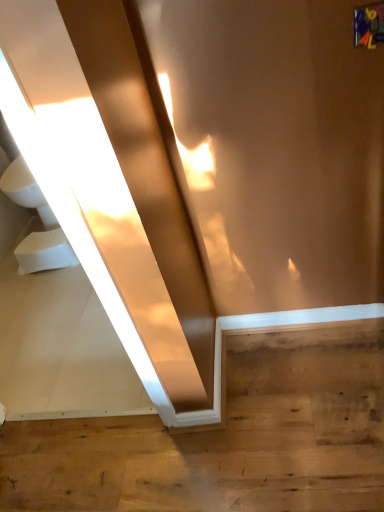
Question: Is wooden floor at lower right in contact with white glossy sink at left?

Choices:
 (A) no
 (B) yes

Answer: (A)

Question: Does wooden floor at lower right appear on the left side of white glossy sink at left?

Choices:
 (A) no
 (B) yes

Answer: (A)

Question: From the image's perspective, does wooden floor at lower right appear lower than white glossy sink at left?

Choices:
 (A) no
 (B) yes

Answer: (B)

Question: Could you tell me if wooden floor at lower right is facing white glossy sink at left?

Choices:
 (A) no
 (B) yes

Answer: (A)

Question: Does wooden floor at lower right have a larger size compared to white glossy sink at left?

Choices:
 (A) no
 (B) yes

Answer: (A)

Question: Considering the relative positions of wooden floor at lower right and white glossy sink at left in the image provided, is wooden floor at lower right to the right of white glossy sink at left from the viewer's perspective?

Choices:
 (A) yes
 (B) no

Answer: (A)

Question: From the image's perspective, is wooden floor at lower right below white foam toilet bowl at lower left?

Choices:
 (A) no
 (B) yes

Answer: (B)

Question: From the image's perspective, is wooden floor at lower right on white foam toilet bowl at lower left?

Choices:
 (A) no
 (B) yes

Answer: (A)

Question: Does wooden floor at lower right have a lesser height compared to white foam toilet bowl at lower left?

Choices:
 (A) yes
 (B) no

Answer: (A)

Question: Is wooden floor at lower right positioned beyond the bounds of white foam toilet bowl at lower left?

Choices:
 (A) no
 (B) yes

Answer: (B)

Question: Is wooden floor at lower right positioned far away from white foam toilet bowl at lower left?

Choices:
 (A) yes
 (B) no

Answer: (A)

Question: Can you confirm if wooden floor at lower right is positioned to the left of white foam toilet bowl at lower left?

Choices:
 (A) no
 (B) yes

Answer: (A)

Question: Considering the relative positions of white foam toilet bowl at lower left and wooden floor at lower right in the image provided, is white foam toilet bowl at lower left to the right of wooden floor at lower right from the viewer's perspective?

Choices:
 (A) yes
 (B) no

Answer: (B)